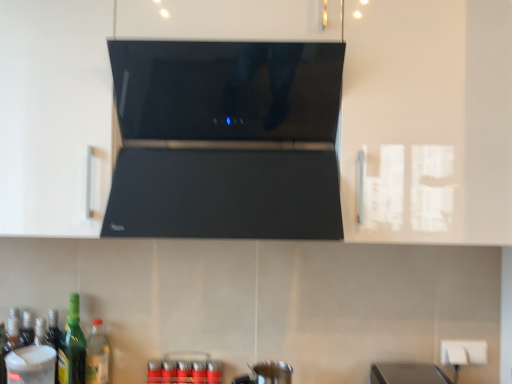
Question: Is transparent plastic container at lower left, the first appliance positioned from the left, facing towards green glass bottle at lower left, which appears as the second bottle when viewed from the right?

Choices:
 (A) yes
 (B) no

Answer: (B)

Question: From the image's perspective, is transparent plastic container at lower left, the first appliance positioned from the left, located beneath green glass bottle at lower left, placed as the second bottle when sorted from left to right?

Choices:
 (A) yes
 (B) no

Answer: (A)

Question: Is transparent plastic container at lower left, which is the 2th appliance in right-to-left order, further to camera compared to green glass bottle at lower left, placed as the second bottle when sorted from left to right?

Choices:
 (A) no
 (B) yes

Answer: (A)

Question: Can you confirm if transparent plastic container at lower left, the first appliance positioned from the left, is wider than green glass bottle at lower left, placed as the second bottle when sorted from left to right?

Choices:
 (A) no
 (B) yes

Answer: (B)

Question: Can you see transparent plastic container at lower left, the first appliance positioned from the left, touching green glass bottle at lower left, which appears as the second bottle when viewed from the right?

Choices:
 (A) yes
 (B) no

Answer: (B)

Question: Is transparent plastic container at lower left, which is the 2th appliance in right-to-left order, shorter than green glass bottle at lower left, which appears as the second bottle when viewed from the right?

Choices:
 (A) yes
 (B) no

Answer: (A)

Question: Can you see white plastic electric outlet at lower right touching black glossy range hood at center?

Choices:
 (A) yes
 (B) no

Answer: (B)

Question: Is white plastic electric outlet at lower right to the right of black glossy range hood at center from the viewer's perspective?

Choices:
 (A) no
 (B) yes

Answer: (B)

Question: From the image's perspective, would you say white plastic electric outlet at lower right is positioned over black glossy range hood at center?

Choices:
 (A) yes
 (B) no

Answer: (B)

Question: Can you confirm if white plastic electric outlet at lower right is wider than black glossy range hood at center?

Choices:
 (A) no
 (B) yes

Answer: (A)

Question: From a real-world perspective, does white plastic electric outlet at lower right stand above black glossy range hood at center?

Choices:
 (A) no
 (B) yes

Answer: (A)

Question: Could black glossy range hood at center be considered to be inside white plastic electric outlet at lower right?

Choices:
 (A) no
 (B) yes

Answer: (A)

Question: Does green glass bottle at lower left, the 1th bottle viewed from the right, have a greater width compared to black glossy range hood at center?

Choices:
 (A) yes
 (B) no

Answer: (B)